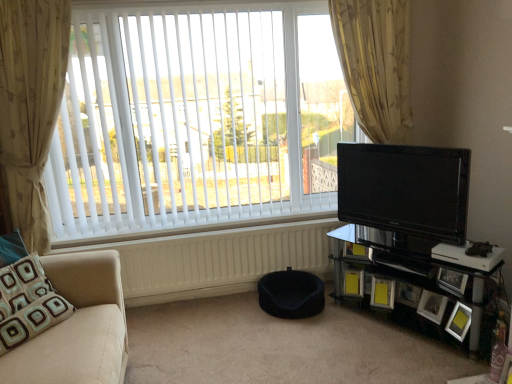
Where is `vacant space to the left of black glass entertainment center at lower right`? The width and height of the screenshot is (512, 384). vacant space to the left of black glass entertainment center at lower right is located at coordinates (337, 337).